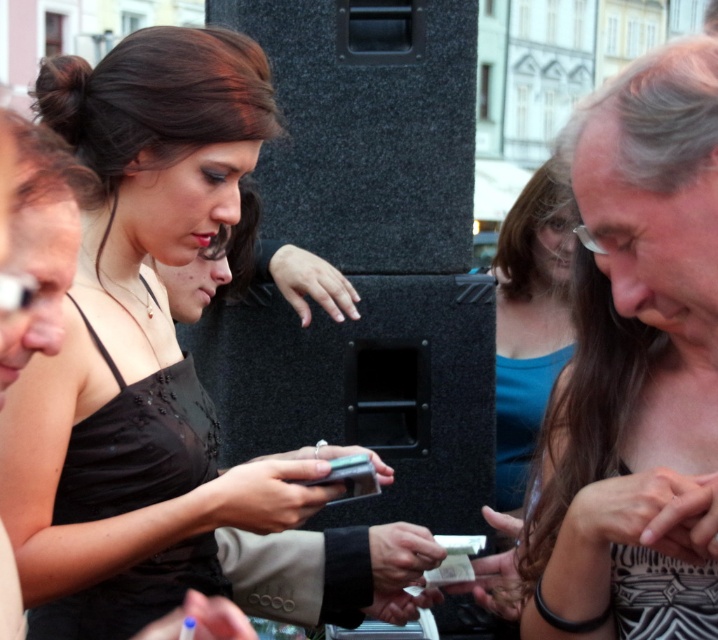
You are organizing a charity event and need to ensure that the matte black dress at center and the black glossy smartphone at center can both fit on a display table. The table has a width of 30 cm. Can both items be placed side by side without overlapping?

The matte black dress at center is wider than the black glossy smartphone at center. However, since the table is only 30 cm wide, it is uncertain if both items can fit side by side without overlapping. More information about their exact dimensions is needed to determine this.

You are at a social event and see a woman wearing a matte black dress at center and holding a black glossy smartphone at center. Which item is located to the right of the other?

The black glossy smartphone at center is located to the right of the matte black dress at center because the matte black dress at center is positioned on the left side of the black glossy smartphone at center.

You are a photographer trying to capture a candid shot of the woman holding the black glossy smartphone at center. However, her gray textured hair at center is blocking part of the view. Based on their positions, can you adjust your angle to the left to get a clearer shot of the smartphone without the hair obscuring it?

Since the gray textured hair at center is to the right of the black glossy smartphone at center, adjusting your angle to the left would move the hair out of the frame, allowing a clearer view of the smartphone.